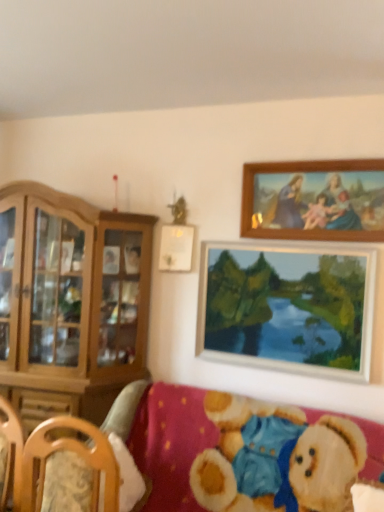
Where is `free point above wooden picture frame at upper right, which is counted as the 3th picture frame, starting from the bottom (from a real-world perspective)`? Image resolution: width=384 pixels, height=512 pixels. free point above wooden picture frame at upper right, which is counted as the 3th picture frame, starting from the bottom (from a real-world perspective) is located at coordinates (316, 152).